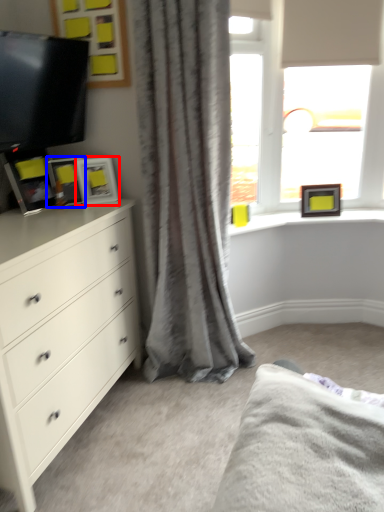
Question: Which of the following is the farthest to the observer, picture frame (highlighted by a red box) or picture frame (highlighted by a blue box)?

Choices:
 (A) picture frame
 (B) picture frame

Answer: (A)